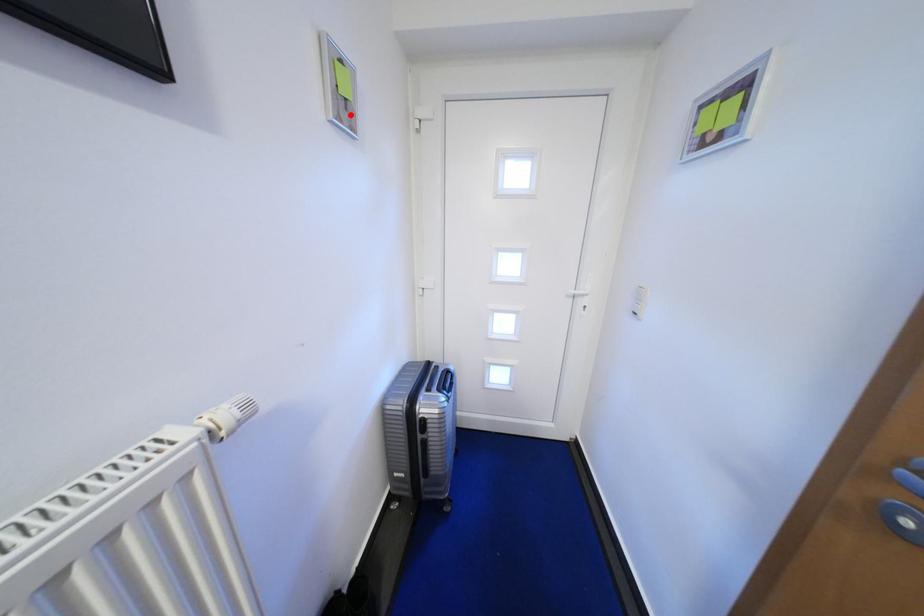
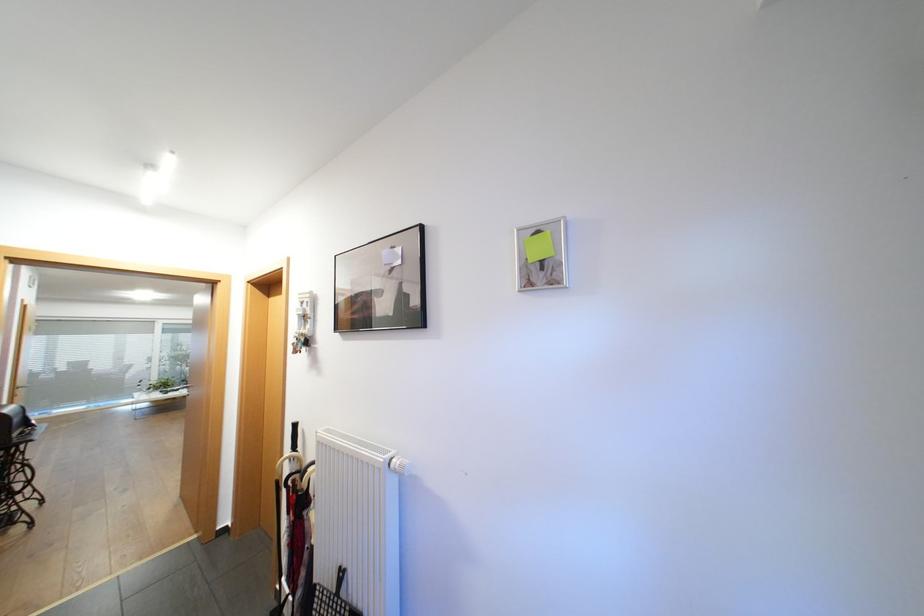
In the second image, find the point that corresponds to the highlighted location in the first image.

(544, 276)